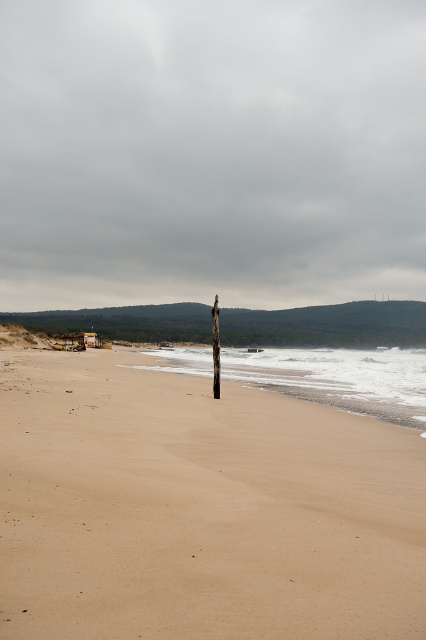
Question: Can you confirm if smooth sand shoreline at center is bigger than brown wooden telegraph pole at center?

Choices:
 (A) no
 (B) yes

Answer: (B)

Question: Does sandy at center have a lesser width compared to brown wooden telegraph pole at center?

Choices:
 (A) yes
 (B) no

Answer: (B)

Question: Is sandy at center to the right of smooth sand shoreline at center from the viewer's perspective?

Choices:
 (A) yes
 (B) no

Answer: (B)

Question: Which point is closer to the camera?

Choices:
 (A) smooth sand shoreline at center
 (B) brown wooden telegraph pole at center
 (C) sandy at center

Answer: (C)

Question: Estimate the real-world distances between objects in this image. Which object is farther from the brown wooden telegraph pole at center?

Choices:
 (A) sandy at center
 (B) smooth sand shoreline at center

Answer: (B)

Question: Which point is closer to the camera taking this photo?

Choices:
 (A) (129, 554)
 (B) (365, 356)

Answer: (A)